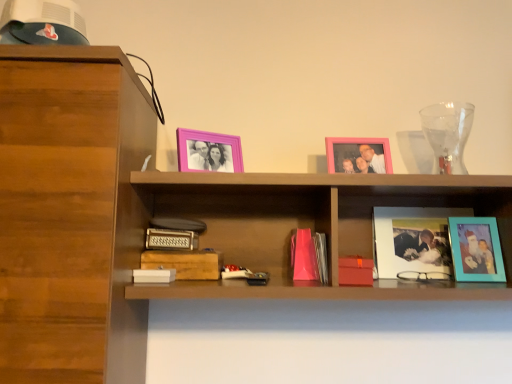
Question: In terms of size, does matte glass photo frame at center right, which is counted as the second picture frame, starting from the right, appear bigger or smaller than matte red paperback book at center, the first paperback book when ordered from right to left?

Choices:
 (A) big
 (B) small

Answer: (A)

Question: From their relative heights in the image, would you say matte glass photo frame at center right, positioned as the 3th picture frame in left-to-right order, is taller or shorter than matte red paperback book at center, the first paperback book when ordered from right to left?

Choices:
 (A) short
 (B) tall

Answer: (B)

Question: Which object is positioned closest to the teal matte picture frame at right, the first picture frame from the right?

Choices:
 (A) white matte paperback book at lower center, which ranks as the first paperback book in left-to-right order
 (B) transparent glass vase at upper right
 (C) wooden paperback book at center, marked as the 3th paperback book in a left-to-right arrangement
 (D) wooden cabinet at left
 (E) matte glass photo frame at center right, positioned as the 3th picture frame in left-to-right order

Answer: (E)

Question: Which object is positioned farthest from the matte glass photo frame at center right, which is counted as the second picture frame, starting from the right?

Choices:
 (A) transparent glass vase at upper right
 (B) pink matte picture frame at upper center, the second picture frame viewed from the left
 (C) wooden paperback book at center, which is counted as the 2th paperback book, starting from the right
 (D) teal matte picture frame at right, the first picture frame from the right
 (E) matte red paperback book at center, the first paperback book when ordered from right to left

Answer: (C)